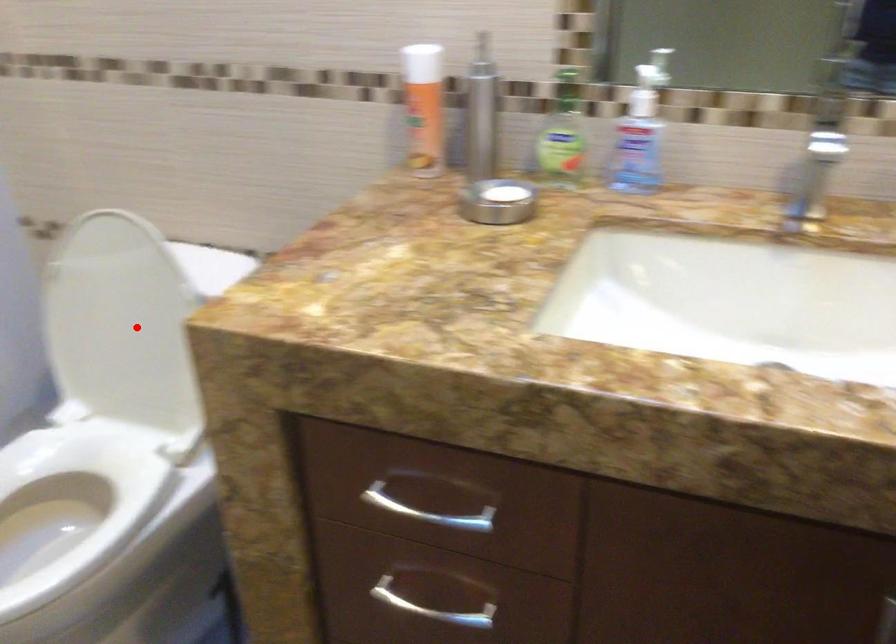
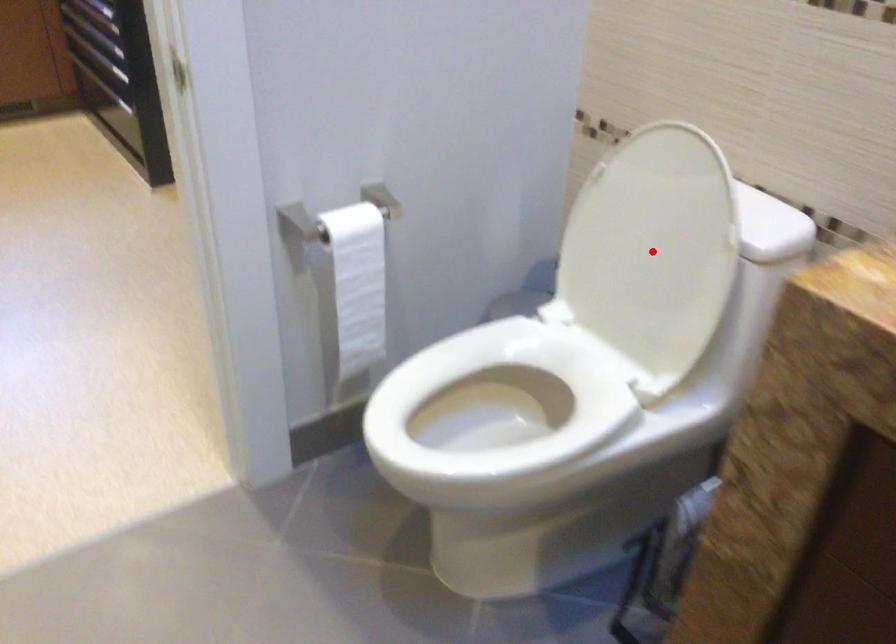
I am providing you with two images of the same scene from different viewpoints. A red point is marked on the first image and another point is marked on the second image. Is the red point in image1 aligned with the point shown in image2?

Yes